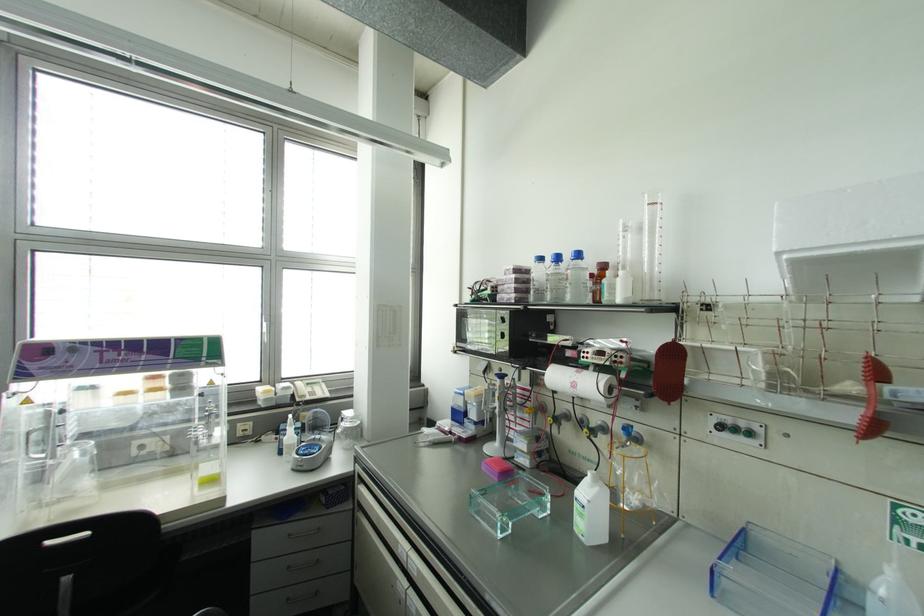
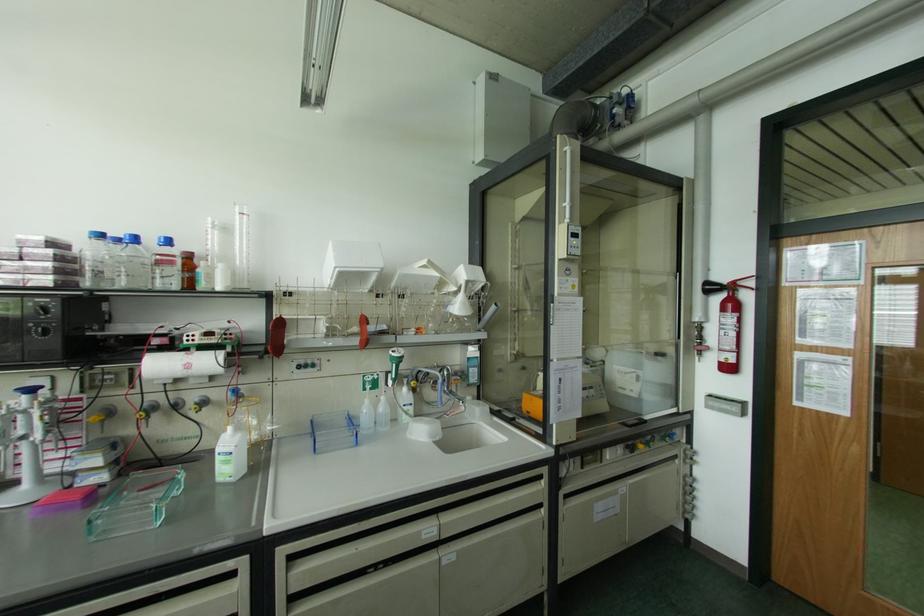
The point at (602, 265) is marked in the first image. Where is the corresponding point in the second image?

(188, 256)